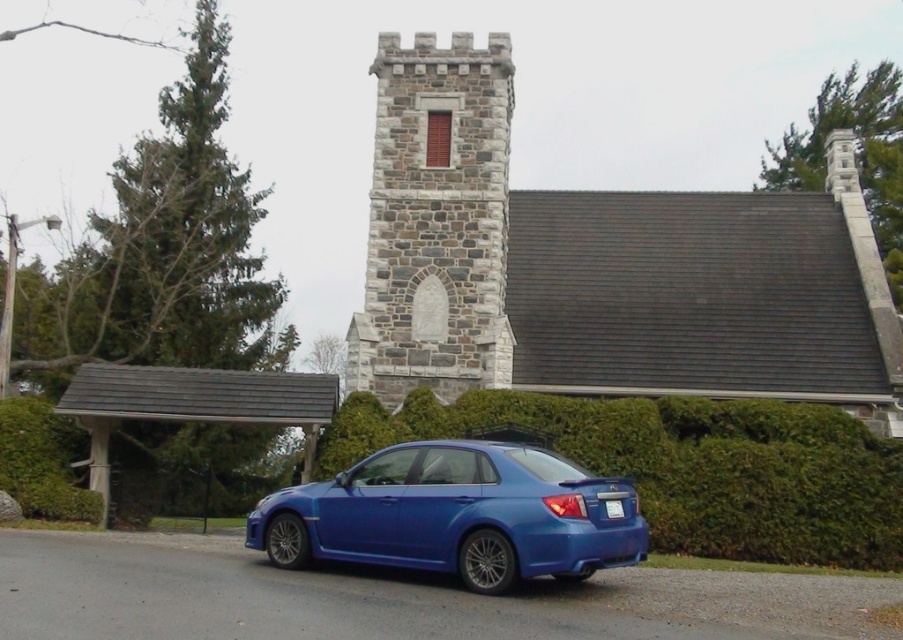
Question: Which of the following is the closest to the observer?

Choices:
 (A) stone church at center
 (B) glossy blue sedan at center
 (C) green leafy hedge at center

Answer: (B)

Question: Is stone church at center smaller than stone brick tower at center?

Choices:
 (A) yes
 (B) no

Answer: (B)

Question: Which point is closer to the camera taking this photo?

Choices:
 (A) (440, 369)
 (B) (812, 417)
 (C) (380, 493)
 (D) (375, 228)

Answer: (C)

Question: Which of the following is the farthest from the observer?

Choices:
 (A) stone church at center
 (B) green leafy hedge at center

Answer: (A)

Question: Is green leafy hedge at center below glossy blue sedan at center?

Choices:
 (A) yes
 (B) no

Answer: (B)

Question: Does stone church at center appear on the right side of green leafy hedge at center?

Choices:
 (A) no
 (B) yes

Answer: (B)